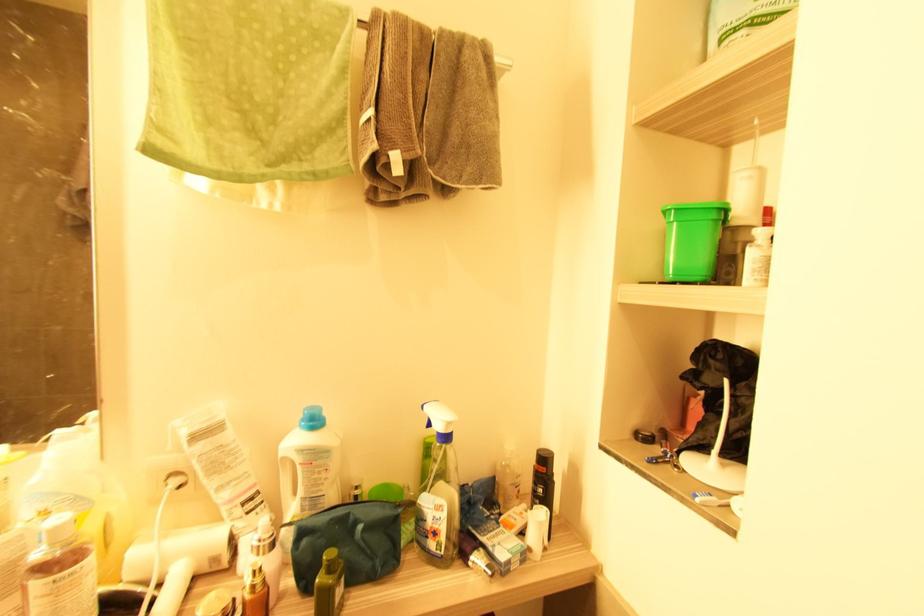
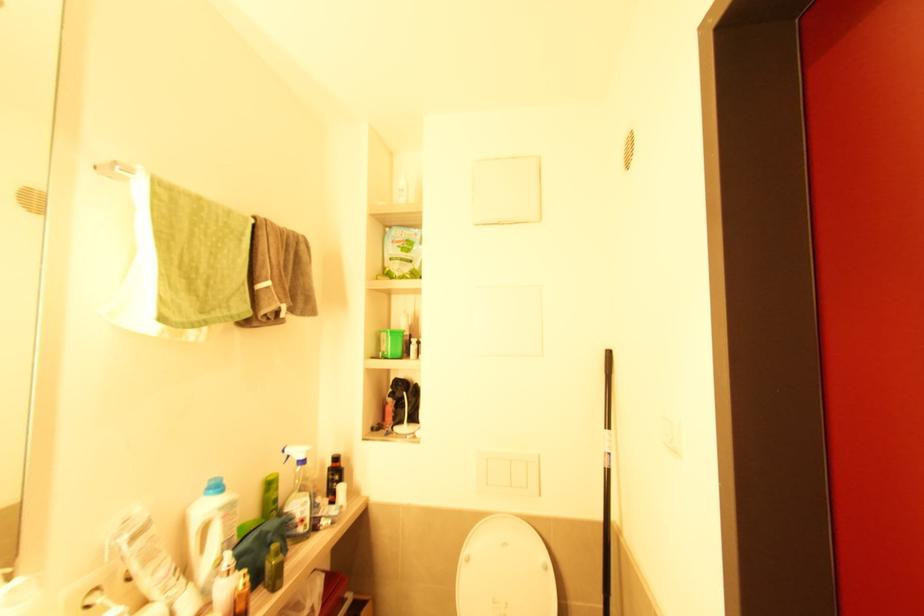
Where in the second image is the point corresponding to point (429, 539) from the first image?

(298, 527)